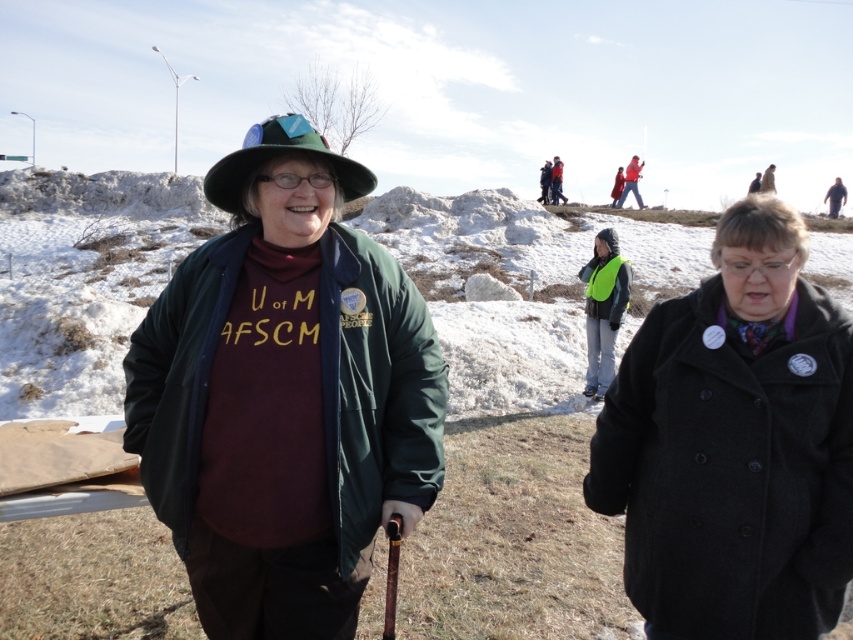
Which is below, green felt hat at center or red wool sweater at upper center?

Positioned lower is green felt hat at center.

Does green felt hat at center have a lesser width compared to red wool sweater at upper center?

Indeed, green felt hat at center has a lesser width compared to red wool sweater at upper center.

Between point (276, 118) and point (555, 170), which one is positioned in front?

Positioned in front is point (276, 118).

In order to click on green felt hat at center in this screenshot , I will do `click(277, 156)`.

Which of these two, green matte jacket at center or red wool sweater at upper center, stands shorter?

green matte jacket at center

Based on the photo, who is lower down, green matte jacket at center or red wool sweater at upper center?

green matte jacket at center is below.

What do you see at coordinates (283, 396) in the screenshot? I see `green matte jacket at center` at bounding box center [283, 396].

At what (x,y) coordinates should I click in order to perform the action: click on green matte jacket at center. Please return your answer as a coordinate pair (x, y). Image resolution: width=853 pixels, height=640 pixels. Looking at the image, I should click on (283, 396).

Between black wool coat at center and snowy hill at center, which one is positioned lower?

black wool coat at center is lower down.

This screenshot has width=853, height=640. In order to click on black wool coat at center in this screenshot , I will do `click(734, 444)`.

Where is `black wool coat at center`? The width and height of the screenshot is (853, 640). black wool coat at center is located at coordinates (734, 444).